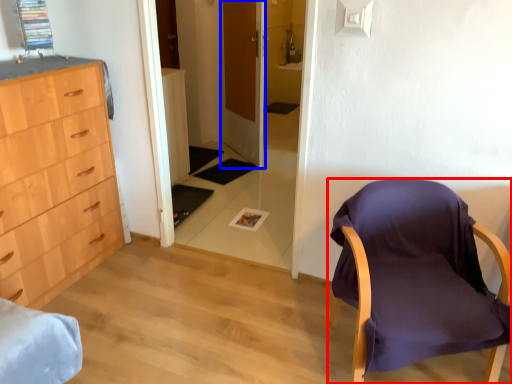
Question: Which point is further to the camera, chair (highlighted by a red box) or door (highlighted by a blue box)?

Choices:
 (A) chair
 (B) door

Answer: (B)